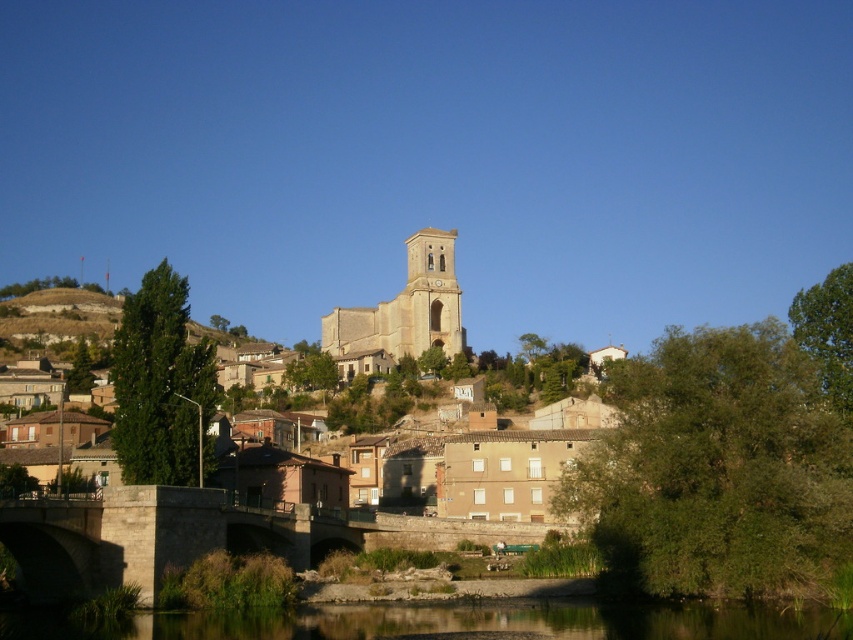
You are a tourist standing at the edge of the town looking towards the church. You notice the clear water at lower center and the light beige stone tower at center. Which one appears taller from your perspective?

The light beige stone tower at center appears taller than the clear water at lower center because the description states that the clear water has a lesser height compared to the tower.

You are standing at the point marked as point (447, 621) in the image. Looking around, you see the clear water at lower center. What is the closest object to you in this scene?

The clear water at lower center is the closest object to you since you are standing at point (447, 621), which corresponds to its location.

You are a tourist visiting the town and want to cross the stone bridge at lower center to reach the other side. However, you have a small boat that is 10 meters long. Can your boat fit across the clear water at lower center?

The clear water at lower center might be wider than the stone bridge at lower center, so the boat might fit if the width of the clear water is at least 10 meters. However, since the exact width isn not provided, it is uncertain.